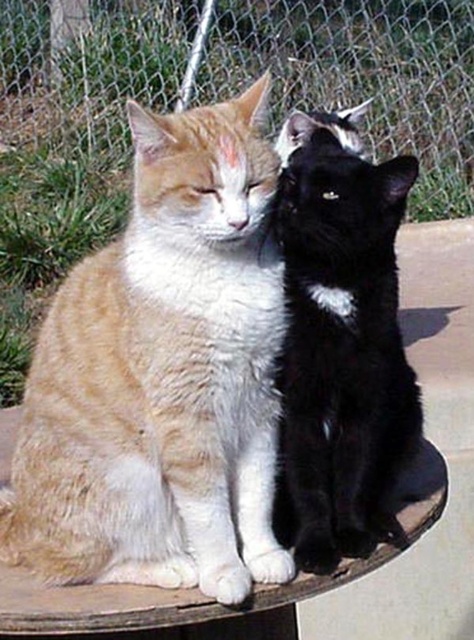
You are a photographer trying to capture the black glossy cat at center. You notice a point at coordinates (339,337). Is this point located on the black glossy cat at center?

Yes, the point at coordinates (339,337) is located on the black glossy cat at center according to the description.

Consider the image. You are standing in a garden and see a tabby fur cat at center. Can you determine if the cat is closer to the left or right side of the image based on its position?

The tabby fur cat at center is located at point (x=163, y=376), which places it closer to the right side of the image.